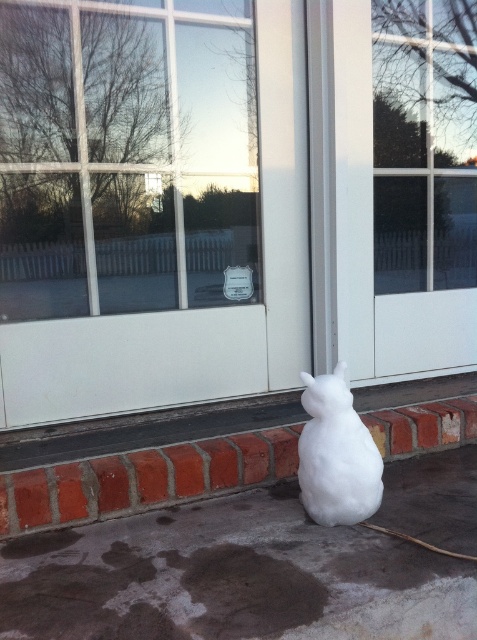
Is point (253, 260) farther from camera compared to point (330, 490)?

That is True.

Can you confirm if transparent glass door at center is positioned to the right of white matte rabbit at lower center?

No, transparent glass door at center is not to the right of white matte rabbit at lower center.

Where is `transparent glass door at center`? The height and width of the screenshot is (640, 477). transparent glass door at center is located at coordinates (125, 156).

Between transparent glass door at center and white matte screen door at upper right, which one has more height?

white matte screen door at upper right

Find the location of a particular element. Image resolution: width=477 pixels, height=640 pixels. transparent glass door at center is located at coordinates (125, 156).

The width and height of the screenshot is (477, 640). What are the coordinates of `transparent glass door at center` in the screenshot? It's located at (125, 156).

Can you confirm if white matte screen door at upper right is thinner than white matte rabbit at lower center?

Incorrect, white matte screen door at upper right's width is not less than white matte rabbit at lower center's.

Who is shorter, white matte screen door at upper right or white matte rabbit at lower center?

white matte rabbit at lower center is shorter.

Who is more forward, (469, 362) or (349, 456)?

Point (349, 456) is in front.

The width and height of the screenshot is (477, 640). Identify the location of white matte screen door at upper right. (372, 234).